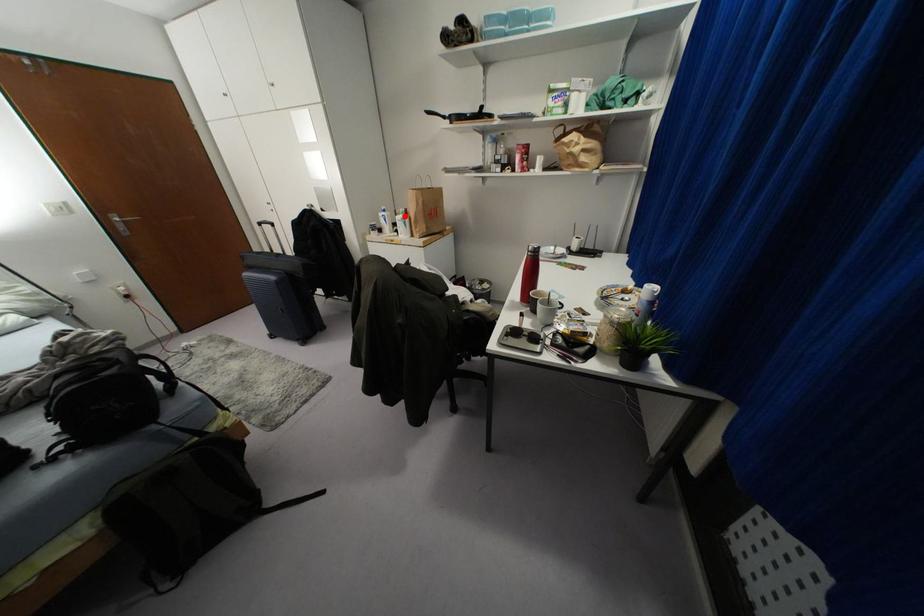
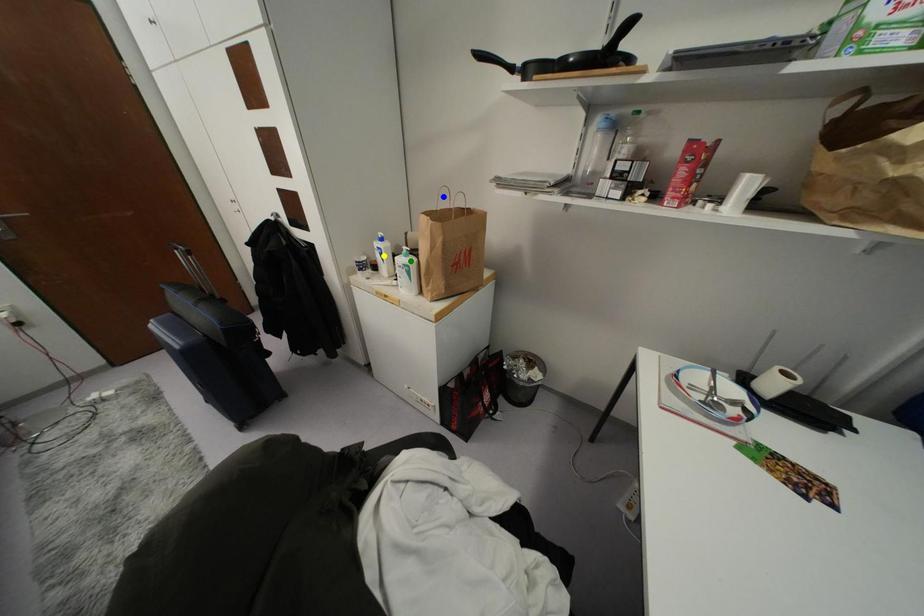
Question: I am providing you with two images of the same scene from different viewpoints. A red point is marked on the first image. You are given multiple points on the second image. In image 2, which mark is for the same physical point as the one in image 1?

Choices:
 (A) green point
 (B) blue point
 (C) yellow point

Answer: (A)